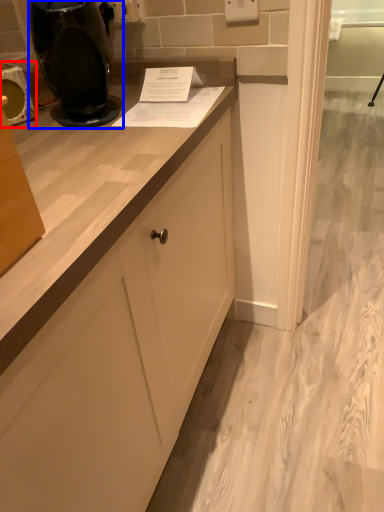
Question: Among these objects, which one is farthest to the camera, appliance (highlighted by a red box) or home appliance (highlighted by a blue box)?

Choices:
 (A) appliance
 (B) home appliance

Answer: (A)